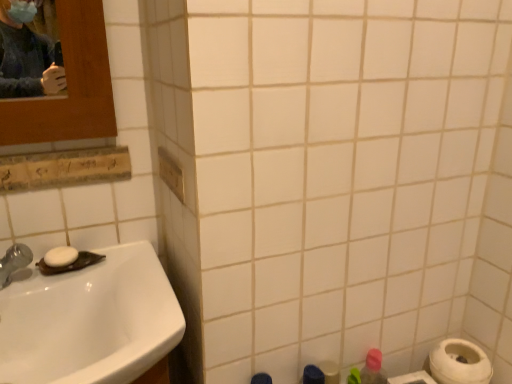
Question: Considering the positions of pink matte bottle at lower right and white glossy sink at lower left in the image, is pink matte bottle at lower right taller or shorter than white glossy sink at lower left?

Choices:
 (A) short
 (B) tall

Answer: (B)

Question: From the image's perspective, relative to white glossy sink at lower left, is pink matte bottle at lower right above or below?

Choices:
 (A) above
 (B) below

Answer: (B)

Question: Which object is positioned farthest from the pink matte bottle at lower right?

Choices:
 (A) white matte toilet paper at lower right
 (B) white glossy sink at lower left
 (C) white matte soap at sink left

Answer: (C)

Question: Estimate the real-world distances between objects in this image. Which object is closer to the pink matte bottle at lower right?

Choices:
 (A) white matte soap at sink left
 (B) white matte toilet paper at lower right
 (C) white glossy sink at lower left

Answer: (B)